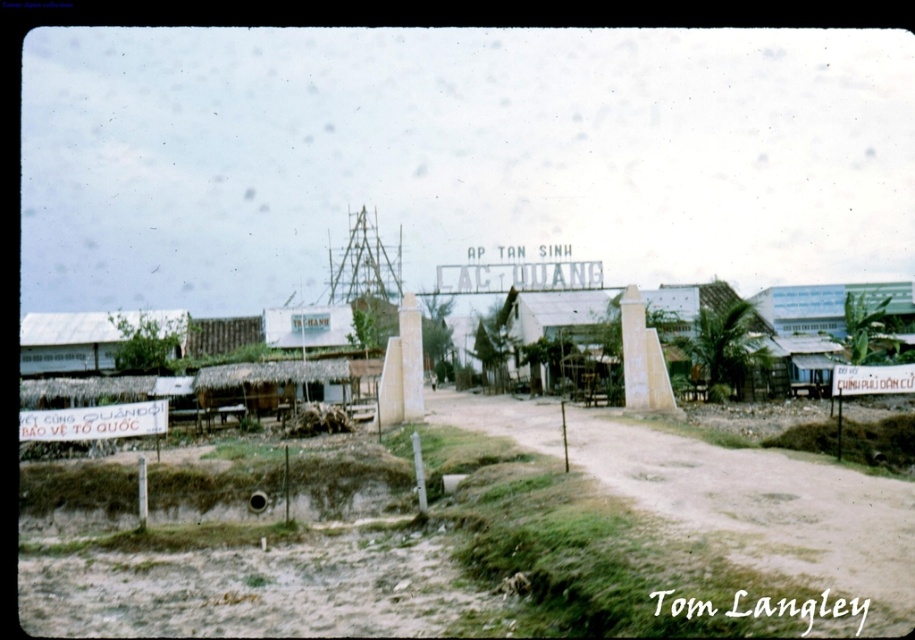
Question: Which object appears farthest from the camera in this image?

Choices:
 (A) green grassy field at lower left
 (B) white corrugated metal hut at lower left

Answer: (B)

Question: Can you confirm if brown sandy dirt track at center is positioned to the left of white corrugated metal hut at lower left?

Choices:
 (A) yes
 (B) no

Answer: (B)

Question: Can you confirm if green grassy field at lower left is positioned to the right of white corrugated metal hut at lower left?

Choices:
 (A) no
 (B) yes

Answer: (B)

Question: Does brown sandy dirt track at center lie behind white corrugated metal hut at lower left?

Choices:
 (A) no
 (B) yes

Answer: (A)

Question: Which of the following is the closest to the observer?

Choices:
 (A) white corrugated metal hut at lower left
 (B) green grassy field at lower left
 (C) brown sandy dirt track at center

Answer: (B)

Question: Which point is farther to the camera?

Choices:
 (A) (862, 488)
 (B) (47, 316)

Answer: (B)